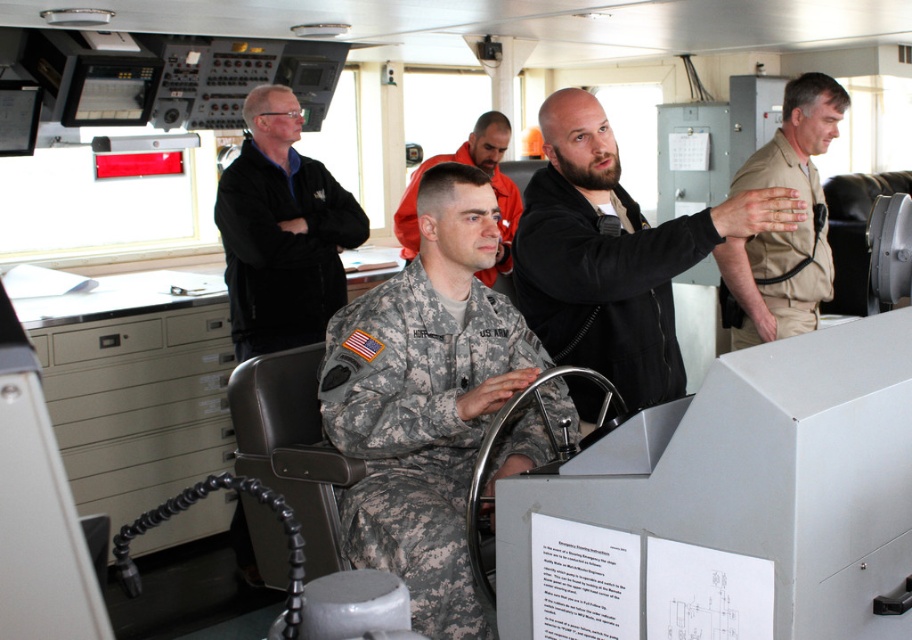
Measure the distance from camouflage fabric uniform at center to tan uniform at right.

They are 4.92 feet apart.

Is point (365, 355) farther from camera compared to point (786, 314)?

No, (365, 355) is closer to viewer.

You are a GUI agent. You are given a task and a screenshot of the screen. Output one action in this format:
    pyautogui.click(x=<x>, y=<y>)
    Task: Click on the camouflage fabric uniform at center
    The image size is (912, 640).
    Given the screenshot: What is the action you would take?
    pyautogui.click(x=417, y=433)

Which is more to the right, black matte jacket at center or tan uniform at right?

Positioned to the right is tan uniform at right.

Does black matte jacket at center have a greater width compared to tan uniform at right?

No.

Between point (539, 252) and point (785, 134), which one is positioned in front?

Positioned in front is point (539, 252).

I want to click on black matte jacket at center, so click(605, 285).

This screenshot has height=640, width=912. What do you see at coordinates (605, 285) in the screenshot?
I see `black matte jacket at center` at bounding box center [605, 285].

You are a GUI agent. You are given a task and a screenshot of the screen. Output one action in this format:
    pyautogui.click(x=<x>, y=<y>)
    Task: Click on the black matte jacket at center
    
    Given the screenshot: What is the action you would take?
    pyautogui.click(x=605, y=285)

Locate an element on the screen. This screenshot has width=912, height=640. black matte jacket at center is located at coordinates (605, 285).